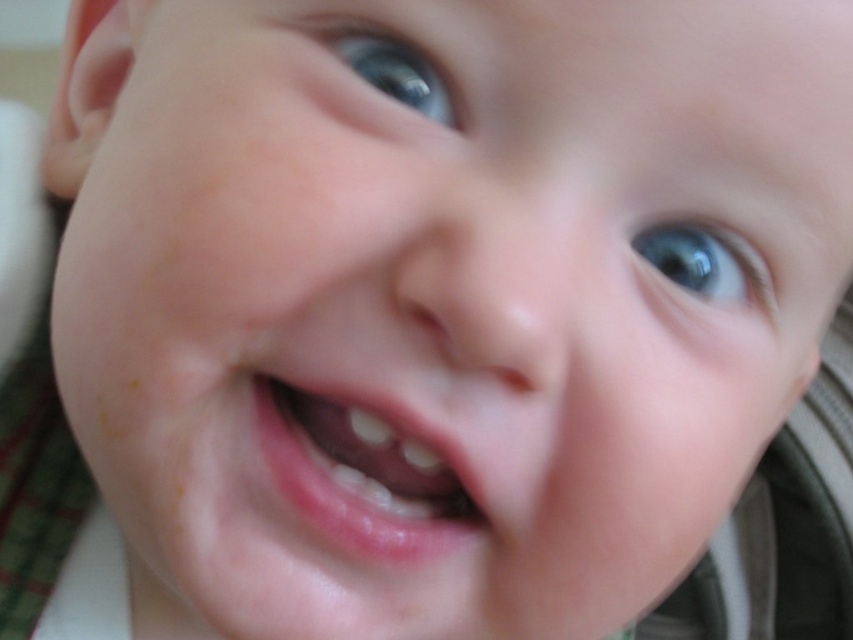
Based on the scene description, can you determine the spatial relationship between the pink glossy lips at center and the blue glossy eye at upper right?

The pink glossy lips at center is positioned under the blue glossy eye at upper right, meaning the lips are located below the eye in the image.

You are a photographer adjusting the focus on your camera. You notice two points in the image labeled as point (415,502) and point (654,237). Which point should you focus on to ensure the baby is in sharp focus?

Point (415,502) is further to the camera than point (654,237). Since the baby is the main subject, you should focus on the point closer to the camera, which is point (415,502), to ensure the baby is in sharp focus.

You are a photographer adjusting the focus on your camera. You want to capture a closeup of the baby while ensuring the pink glossy lips at center are in sharp focus. Given that the lips are 8.74 inches away from the camera, what distance should your camera be set to for optimal focus?

The camera should be set to focus at 8.74 inches to ensure the pink glossy lips at center are in sharp focus.